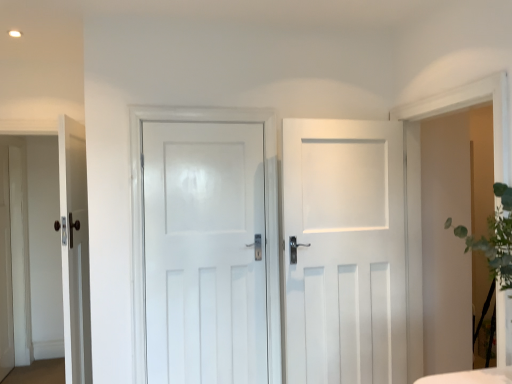
Question: Can you confirm if white matte door at center, which ranks as the first door in right-to-left order, is smaller than matte white door at left, the first door when ordered from left to right?

Choices:
 (A) yes
 (B) no

Answer: (A)

Question: Can you confirm if white matte door at center, which is the third door in left-to-right order, is positioned to the right of matte white door at left, positioned as the third door in right-to-left order?

Choices:
 (A) yes
 (B) no

Answer: (A)

Question: Would you say white matte door at center, which is the third door in left-to-right order, is outside matte white door at left, the first door when ordered from left to right?

Choices:
 (A) no
 (B) yes

Answer: (B)

Question: Is matte white door at left, the first door when ordered from left to right, at the back of white matte door at center, which ranks as the first door in right-to-left order?

Choices:
 (A) yes
 (B) no

Answer: (B)

Question: Does white matte door at center, which ranks as the first door in right-to-left order, turn towards matte white door at left, the first door when ordered from left to right?

Choices:
 (A) no
 (B) yes

Answer: (A)

Question: Is white matte door at center, which is the third door in left-to-right order, spatially inside white glossy door at center, the 2th door when ordered from left to right, or outside of it?

Choices:
 (A) outside
 (B) inside

Answer: (A)

Question: Is white matte door at center, which ranks as the first door in right-to-left order, wider or thinner than white glossy door at center, the 2th door when ordered from left to right?

Choices:
 (A) thin
 (B) wide

Answer: (B)

Question: From a real-world perspective, is white matte door at center, which ranks as the first door in right-to-left order, physically located above or below white glossy door at center, the 2th door when ordered from left to right?

Choices:
 (A) above
 (B) below

Answer: (B)

Question: In the image, is white matte door at center, which is the third door in left-to-right order, on the left side or the right side of white glossy door at center, the 2th door when ordered from left to right?

Choices:
 (A) left
 (B) right

Answer: (B)

Question: Considering their positions, is white glossy door at center, the 2th door when ordered from left to right, located in front of or behind matte white door at left, positioned as the third door in right-to-left order?

Choices:
 (A) behind
 (B) front

Answer: (A)

Question: From a real-world perspective, is white glossy door at center, marked as the second door in a right-to-left arrangement, above or below matte white door at left, positioned as the third door in right-to-left order?

Choices:
 (A) above
 (B) below

Answer: (A)

Question: In terms of height, does white glossy door at center, marked as the second door in a right-to-left arrangement, look taller or shorter compared to matte white door at left, positioned as the third door in right-to-left order?

Choices:
 (A) short
 (B) tall

Answer: (A)

Question: Looking at the image, does white glossy door at center, marked as the second door in a right-to-left arrangement, seem bigger or smaller compared to matte white door at left, the first door when ordered from left to right?

Choices:
 (A) big
 (B) small

Answer: (B)

Question: Looking at their shapes, would you say white glossy door at center, the 2th door when ordered from left to right, is wider or thinner than white matte door at center, which is the third door in left-to-right order?

Choices:
 (A) wide
 (B) thin

Answer: (B)

Question: Choose the correct answer: Is white glossy door at center, the 2th door when ordered from left to right, inside white matte door at center, which ranks as the first door in right-to-left order, or outside it?

Choices:
 (A) outside
 (B) inside

Answer: (A)